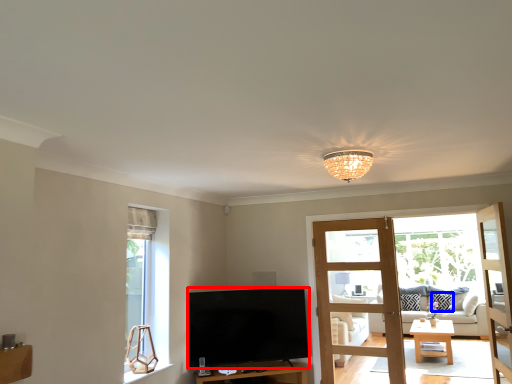
Question: Among these objects, which one is farthest to the camera, television (highlighted by a red box) or pillow (highlighted by a blue box)?

Choices:
 (A) television
 (B) pillow

Answer: (B)